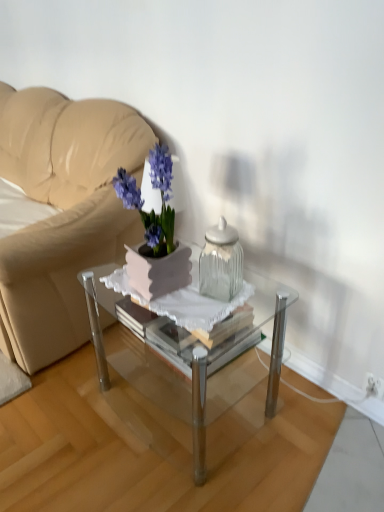
Locate an element on the screen. vacant space to the right of clear glass coffee table at center is located at coordinates (314, 423).